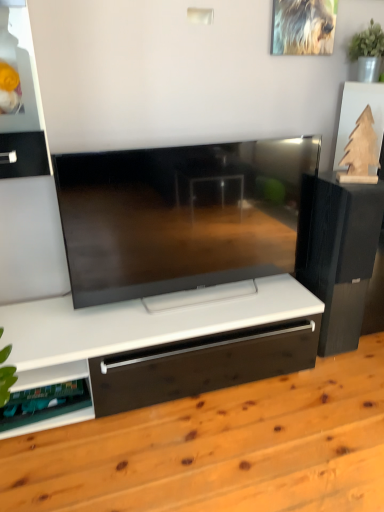
Question: Does green plastic shelf at lower left lie behind wooden floor at center?

Choices:
 (A) yes
 (B) no

Answer: (A)

Question: Can you confirm if green plastic shelf at lower left is taller than wooden floor at center?

Choices:
 (A) yes
 (B) no

Answer: (B)

Question: Does green plastic shelf at lower left have a larger size compared to wooden floor at center?

Choices:
 (A) yes
 (B) no

Answer: (B)

Question: Can you confirm if green plastic shelf at lower left is wider than wooden floor at center?

Choices:
 (A) no
 (B) yes

Answer: (A)

Question: From the image's perspective, is green plastic shelf at lower left over wooden floor at center?

Choices:
 (A) no
 (B) yes

Answer: (B)

Question: Is green plastic shelf at lower left next to wooden floor at center and touching it?

Choices:
 (A) no
 (B) yes

Answer: (A)

Question: Does wooden floor at center lie in front of green plastic shelf at lower left?

Choices:
 (A) no
 (B) yes

Answer: (B)

Question: Can you confirm if wooden floor at center is wider than green plastic shelf at lower left?

Choices:
 (A) yes
 (B) no

Answer: (A)

Question: Is wooden floor at center aimed at green plastic shelf at lower left?

Choices:
 (A) no
 (B) yes

Answer: (A)

Question: Is wooden floor at center turned away from green plastic shelf at lower left?

Choices:
 (A) no
 (B) yes

Answer: (A)

Question: Is wooden floor at center next to green plastic shelf at lower left?

Choices:
 (A) no
 (B) yes

Answer: (A)

Question: Can you confirm if wooden floor at center is shorter than green plastic shelf at lower left?

Choices:
 (A) yes
 (B) no

Answer: (B)

Question: Can you confirm if black matte speaker at right is bigger than wooden floor at center?

Choices:
 (A) no
 (B) yes

Answer: (A)